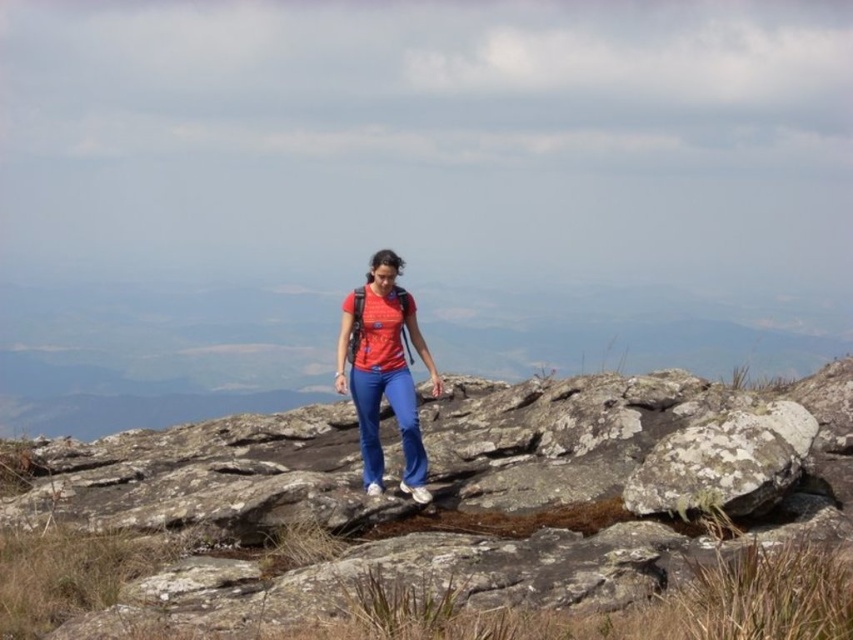
Question: Is lichen-covered rock at center-right bigger than matte red shirt at center?

Choices:
 (A) yes
 (B) no

Answer: (B)

Question: Does lichen-covered rock at center-right appear over matte red shirt at center?

Choices:
 (A) no
 (B) yes

Answer: (A)

Question: Among these points, which one is nearest to the camera?

Choices:
 (A) (732, 426)
 (B) (401, 304)

Answer: (A)

Question: Based on their relative distances, which object is farther from the lichen-covered rock at center?

Choices:
 (A) matte red shirt at center
 (B) lichen-covered rock at center-right

Answer: (B)

Question: From the image, what is the correct spatial relationship of lichen-covered rock at center-right in relation to matte red shirt at center?

Choices:
 (A) right
 (B) left

Answer: (A)

Question: Among these points, which one is nearest to the camera?

Choices:
 (A) (367, 435)
 (B) (566, 420)
 (C) (656, 465)

Answer: (C)